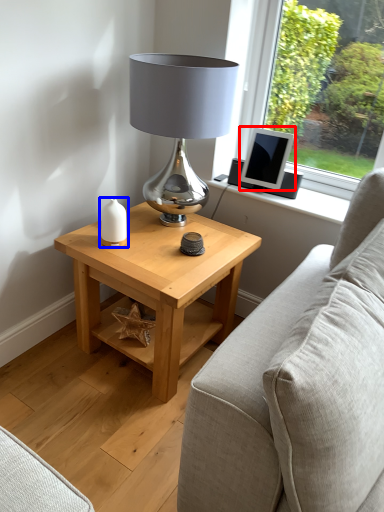
Question: Which object appears closest to the camera in this image, computer monitor (highlighted by a red box) or candle holder (highlighted by a blue box)?

Choices:
 (A) computer monitor
 (B) candle holder

Answer: (B)